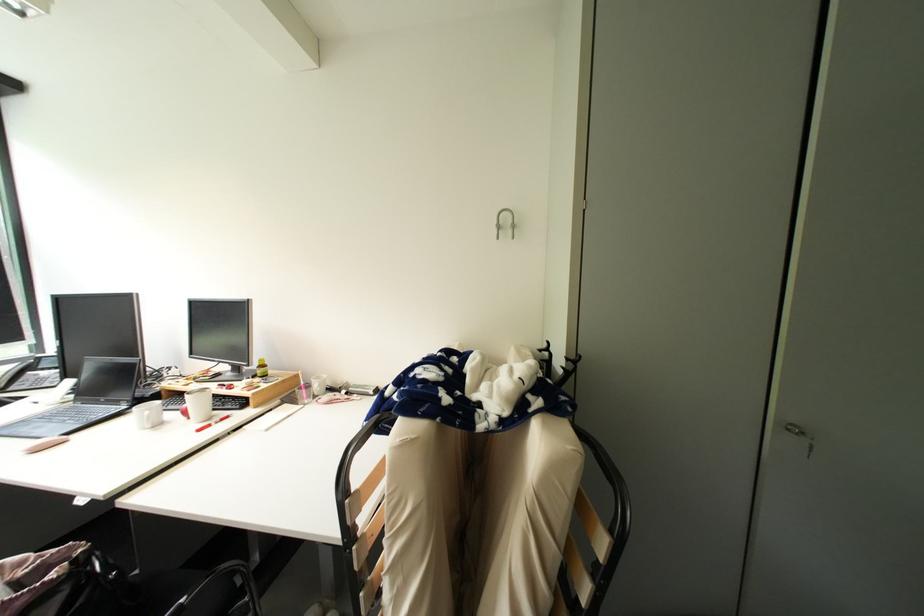
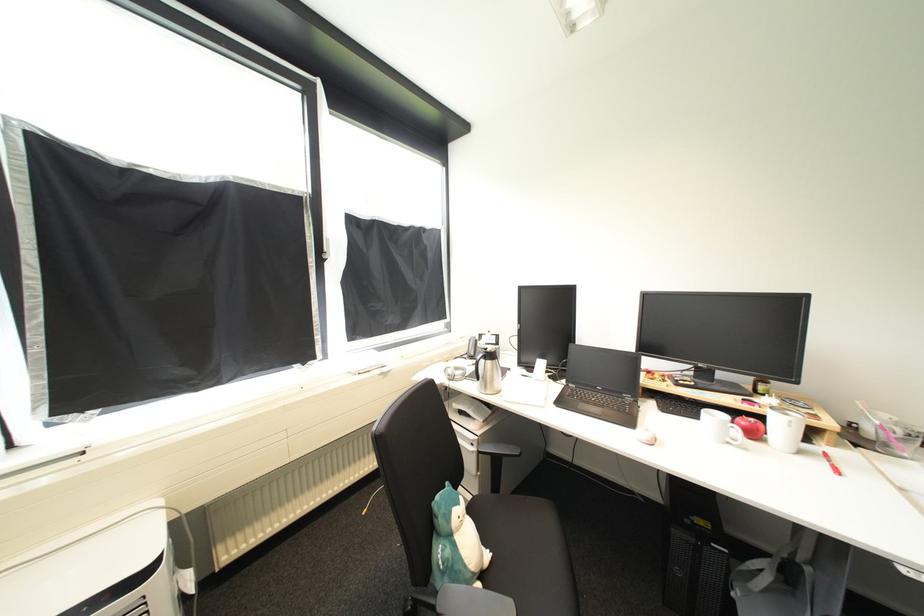
Find the pixel in the second image that matches [159,429] in the first image.

(736, 445)